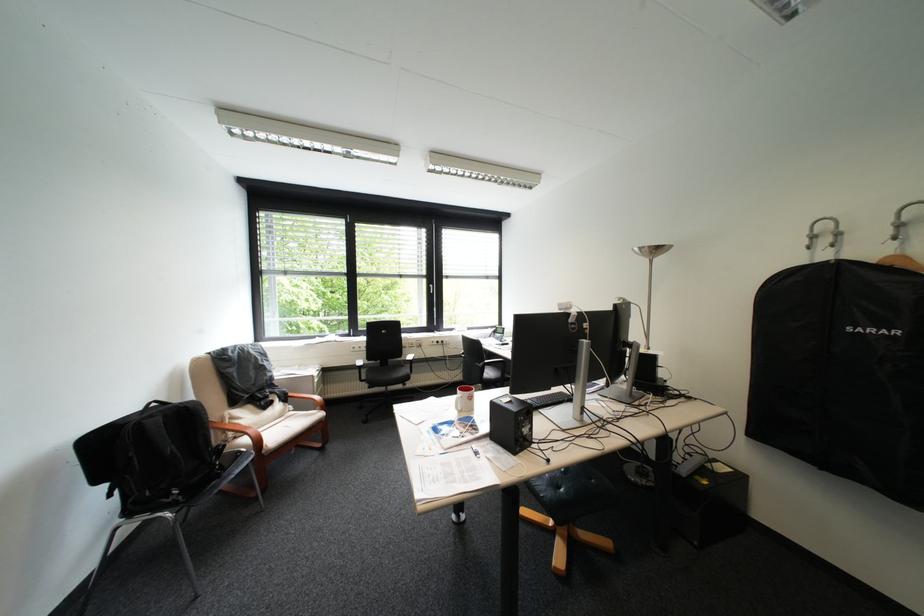
You are a GUI agent. You are given a task and a screenshot of the screen. Output one action in this format:
    pyautogui.click(x=<x>, y=<y>)
    Task: Click on the red and white mug
    
    Given the screenshot: What is the action you would take?
    pyautogui.click(x=464, y=399)